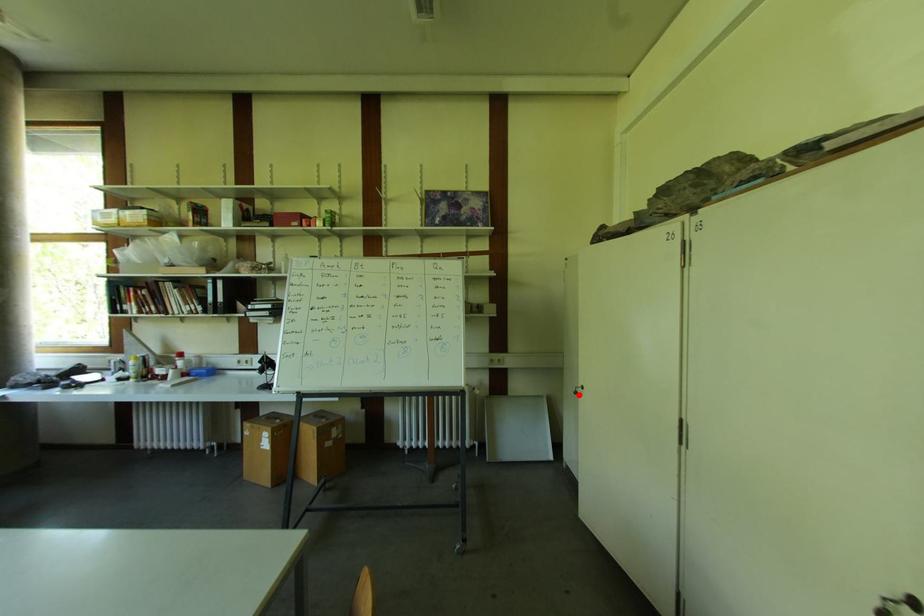
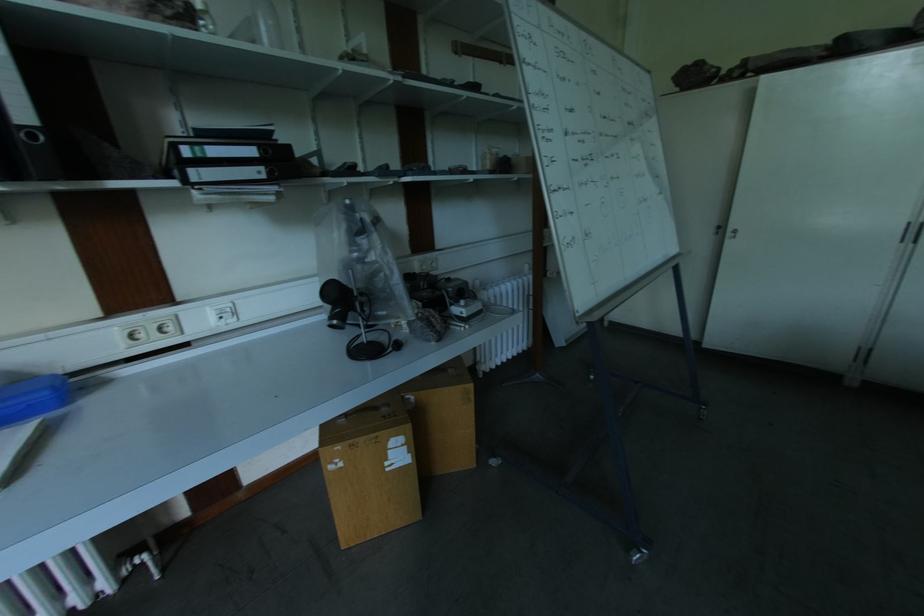
The point at the highlighted location is marked in the first image. Where is the corresponding point in the second image?

(737, 238)